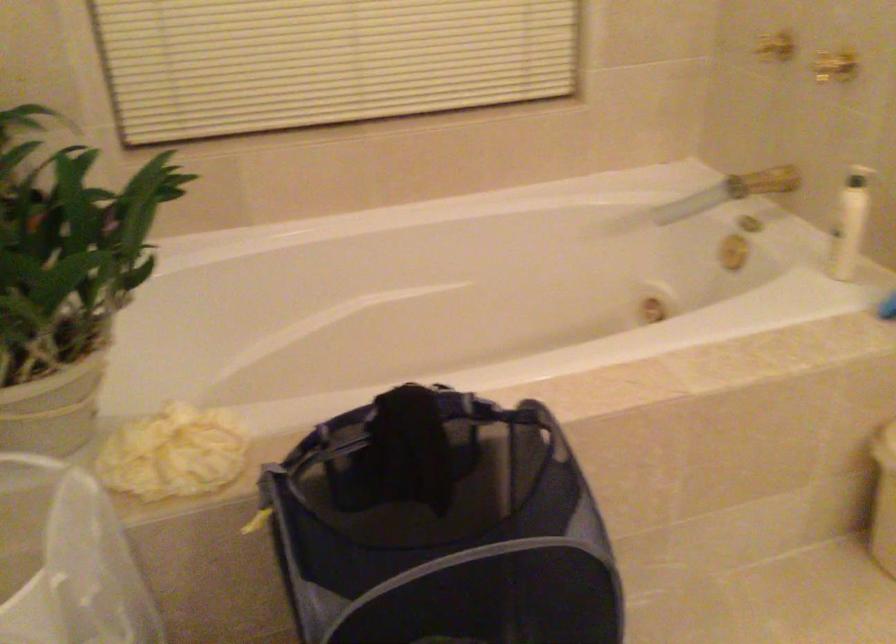
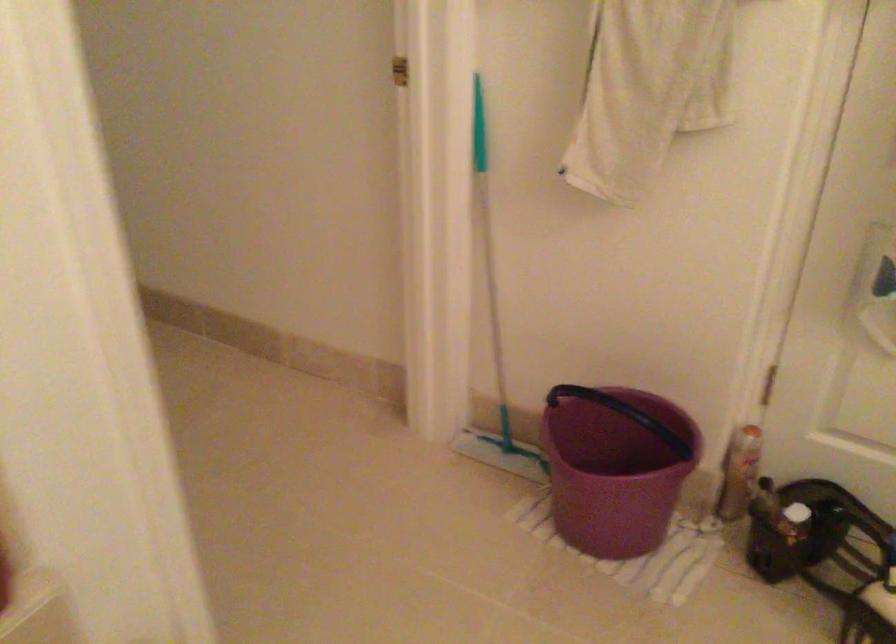
Question: The camera is either moving clockwise (left) or counter-clockwise (right) around the object. The first image is from the beginning of the video and the second image is from the end. Is the camera moving left or right when shooting the video?

Choices:
 (A) Left
 (B) Right

Answer: (A)